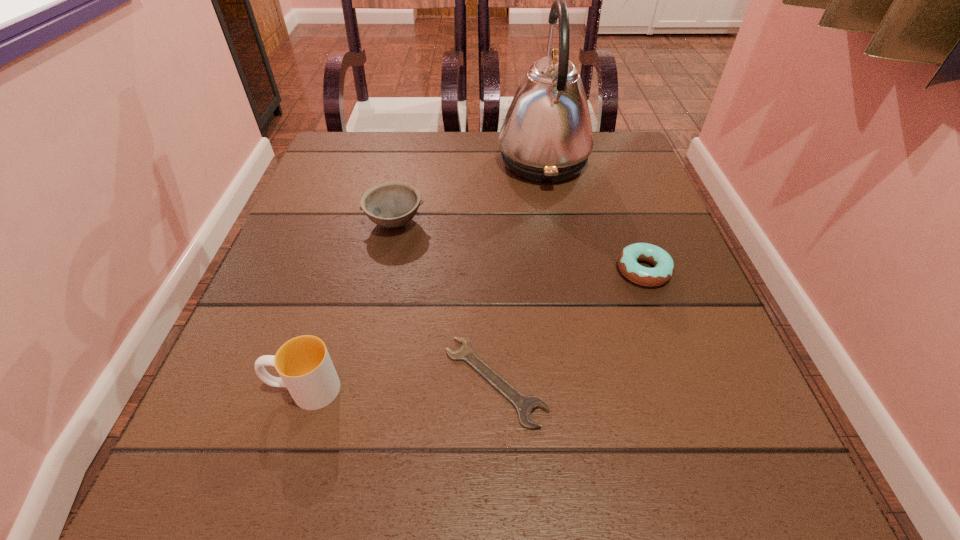
Where is `vacant space that satisfies the following two spatial constraints: 1. on the back side of the doughnut; 2. from the spout of the farthest object`? This screenshot has height=540, width=960. vacant space that satisfies the following two spatial constraints: 1. on the back side of the doughnut; 2. from the spout of the farthest object is located at coordinates (604, 162).

Find the location of `free spot that satisfies the following two spatial constraints: 1. with the handle on the side of the shortest object; 2. on the right side of the cup`. free spot that satisfies the following two spatial constraints: 1. with the handle on the side of the shortest object; 2. on the right side of the cup is located at coordinates (307, 381).

At what (x,y) coordinates should I click in order to perform the action: click on vacant space that satisfies the following two spatial constraints: 1. with the handle on the side of the bowl; 2. on the left side of the cup. Please return your answer as a coordinate pair (x, y). Looking at the image, I should click on (356, 222).

Image resolution: width=960 pixels, height=540 pixels. Identify the location of free spot that satisfies the following two spatial constraints: 1. from the spout of the tallest object; 2. on the left side of the third farthest object. (563, 271).

Locate an element on the screen. The image size is (960, 540). vacant region that satisfies the following two spatial constraints: 1. from the spout of the kettle; 2. on the front side of the shortest object is located at coordinates (583, 381).

Locate an element on the screen. This screenshot has width=960, height=540. vacant space that satisfies the following two spatial constraints: 1. from the spout of the farthest object; 2. on the back side of the fourth tallest object is located at coordinates [x=563, y=271].

Identify the location of free spot that satisfies the following two spatial constraints: 1. on the front side of the shortest object; 2. on the right side of the fourth nearest object. This screenshot has width=960, height=540. (361, 381).

At what (x,y) coordinates should I click in order to perform the action: click on blank area in the image that satisfies the following two spatial constraints: 1. with the handle on the side of the second tallest object; 2. on the left side of the doughnut. Please return your answer as a coordinate pair (x, y). Image resolution: width=960 pixels, height=540 pixels. Looking at the image, I should click on (341, 271).